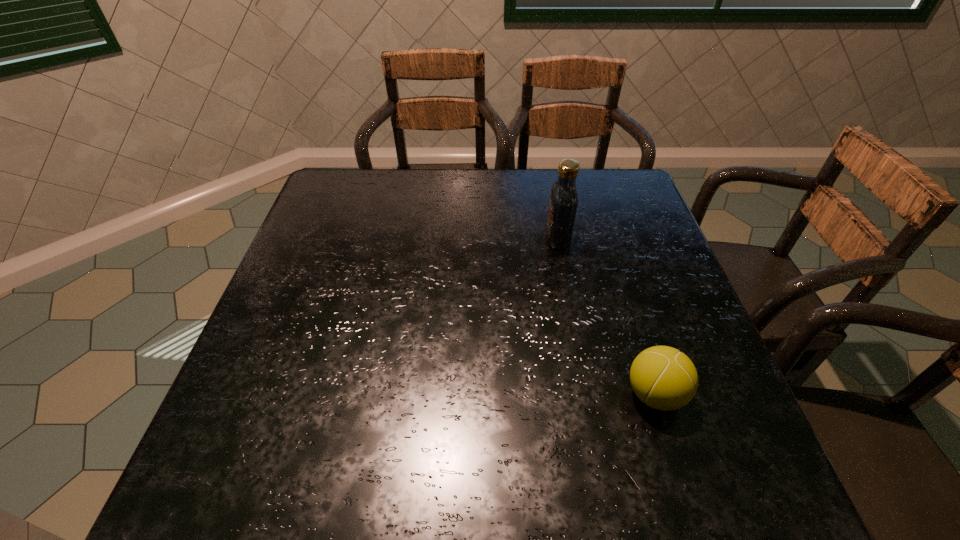
The height and width of the screenshot is (540, 960). Find the location of `free region at the near edge of the desktop`. free region at the near edge of the desktop is located at coordinates (315, 485).

The height and width of the screenshot is (540, 960). In the image, there is a desktop. What are the coordinates of `blank space at the left edge` in the screenshot? It's located at (255, 441).

Where is `vacant space at the right edge`? Image resolution: width=960 pixels, height=540 pixels. vacant space at the right edge is located at coordinates (649, 275).

This screenshot has height=540, width=960. What are the coordinates of `blank space at the far left corner of the desktop` in the screenshot? It's located at (326, 203).

I want to click on free space at the near left corner of the desktop, so tap(285, 500).

Where is `free space at the far right corner of the desktop`? Image resolution: width=960 pixels, height=540 pixels. free space at the far right corner of the desktop is located at coordinates (632, 187).

At what (x,y) coordinates should I click in order to perform the action: click on vacant space that satisfies the following two spatial constraints: 1. on the front-facing side of the vodka; 2. on the left side of the shorter object. Please return your answer as a coordinate pair (x, y). Image resolution: width=960 pixels, height=540 pixels. Looking at the image, I should click on (588, 394).

At what (x,y) coordinates should I click in order to perform the action: click on vacant space that satisfies the following two spatial constraints: 1. on the back side of the tennis ball; 2. on the front-facing side of the left object. Please return your answer as a coordinate pair (x, y). This screenshot has height=540, width=960. Looking at the image, I should click on (606, 238).

The image size is (960, 540). Find the location of `vacant space that satisfies the following two spatial constraints: 1. on the front-facing side of the vodka; 2. on the right side of the tennis ball`. vacant space that satisfies the following two spatial constraints: 1. on the front-facing side of the vodka; 2. on the right side of the tennis ball is located at coordinates 588,394.

The image size is (960, 540). Identify the location of vacant space that satisfies the following two spatial constraints: 1. on the front-facing side of the nearer object; 2. on the right side of the vodka. (588, 394).